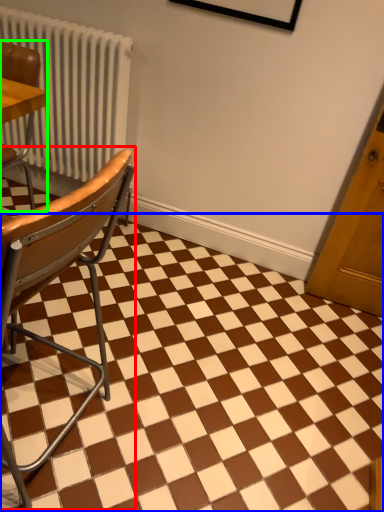
Question: Which object is the closest to the chair (highlighted by a red box)? Choose among these: square (highlighted by a blue box) or chair (highlighted by a green box).

Choices:
 (A) square
 (B) chair

Answer: (A)